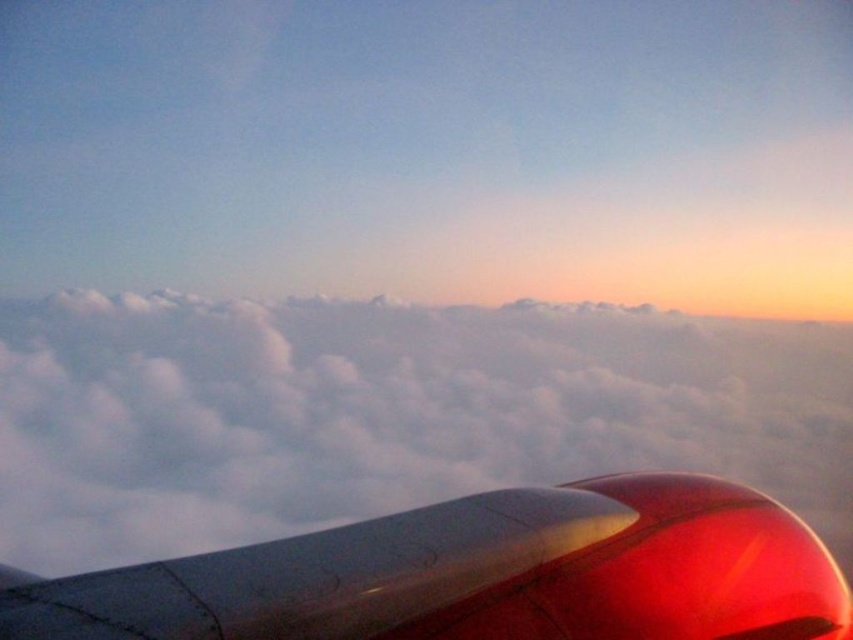
Question: Can you confirm if white fluffy cloud at center is bigger than glossy metallic engine at lower right?

Choices:
 (A) yes
 (B) no

Answer: (A)

Question: Which object is farther from the camera taking this photo?

Choices:
 (A) glossy metallic engine at lower right
 (B) white fluffy cloud at center

Answer: (B)

Question: Does white fluffy cloud at center lie in front of glossy metallic engine at lower right?

Choices:
 (A) no
 (B) yes

Answer: (A)

Question: Can you confirm if white fluffy cloud at center is thinner than glossy metallic engine at lower right?

Choices:
 (A) no
 (B) yes

Answer: (A)

Question: Which point is farther from the camera taking this photo?

Choices:
 (A) (315, 428)
 (B) (596, 538)

Answer: (A)